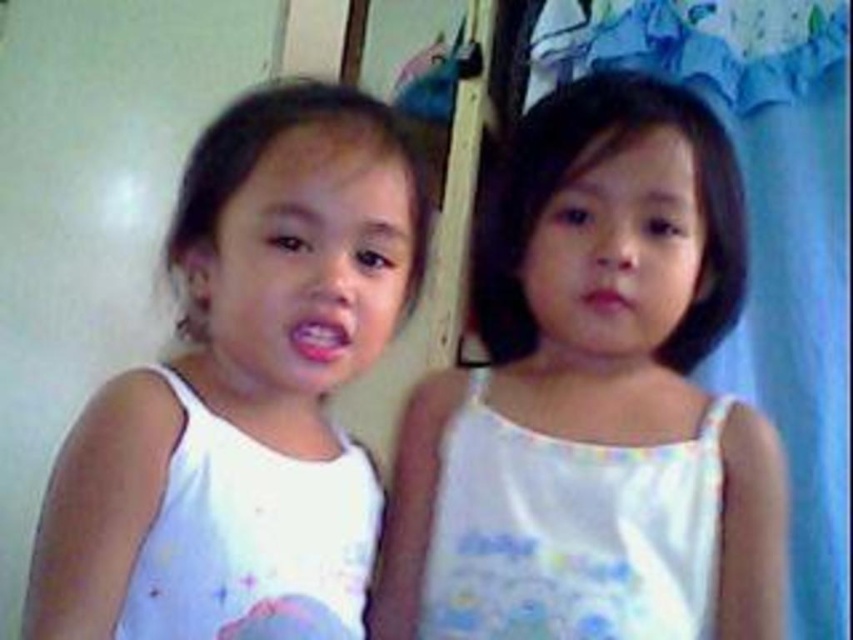
Can you confirm if white fabric dress at center is positioned to the right of matte pink lips at center?

Indeed, white fabric dress at center is positioned on the right side of matte pink lips at center.

Find the location of a particular element. The image size is (853, 640). white fabric dress at center is located at coordinates (636, 307).

This screenshot has height=640, width=853. In order to click on white fabric dress at center in this screenshot , I will do `click(636, 307)`.

Does pink glossy lips at center appear over matte pink lips at center?

No, pink glossy lips at center is not above matte pink lips at center.

Consider the image. Measure the distance from pink glossy lips at center to matte pink lips at center.

They are 10.59 inches apart.

The image size is (853, 640). What are the coordinates of `pink glossy lips at center` in the screenshot? It's located at (318, 339).

The width and height of the screenshot is (853, 640). What do you see at coordinates (636, 307) in the screenshot?
I see `white fabric dress at center` at bounding box center [636, 307].

Is point (611, 112) positioned after point (115, 566)?

Yes, point (611, 112) is farther from viewer.

Where is `white fabric dress at center`? white fabric dress at center is located at coordinates (636, 307).